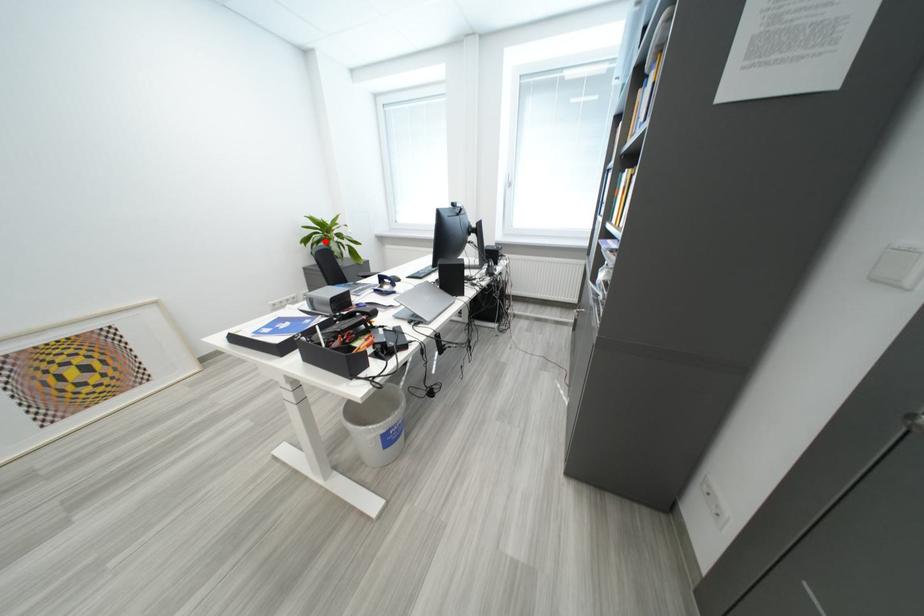
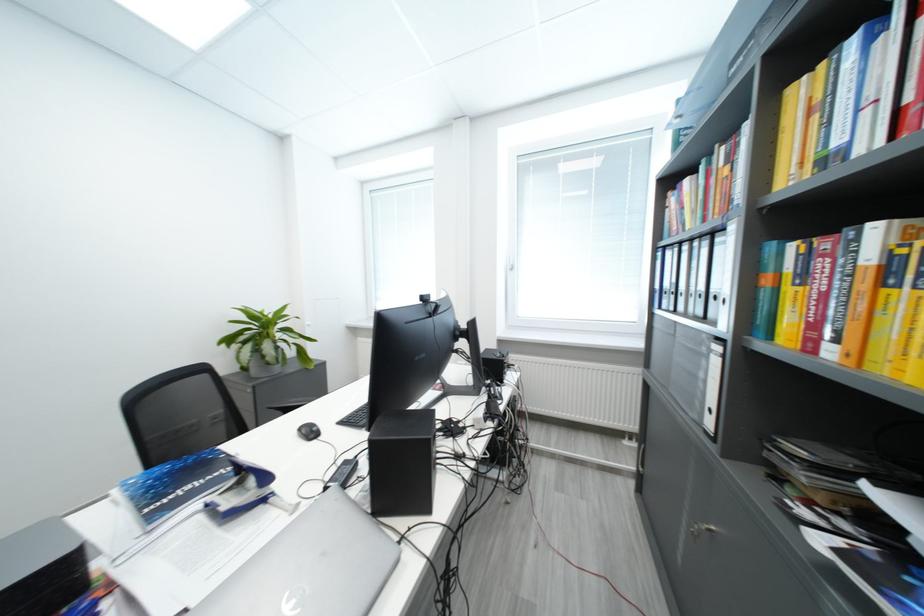
Question: I am providing you with two images of the same scene from different viewpoints. In image1, a red point is highlighted. Considering the same 3D point in image2, which of the following is correct?

Choices:
 (A) It is closer
 (B) It is farther

Answer: (B)